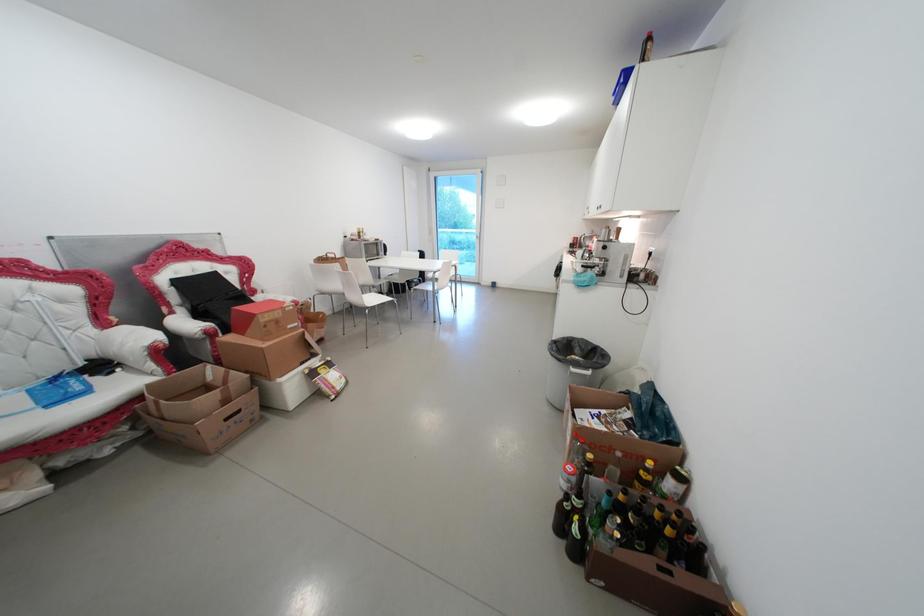
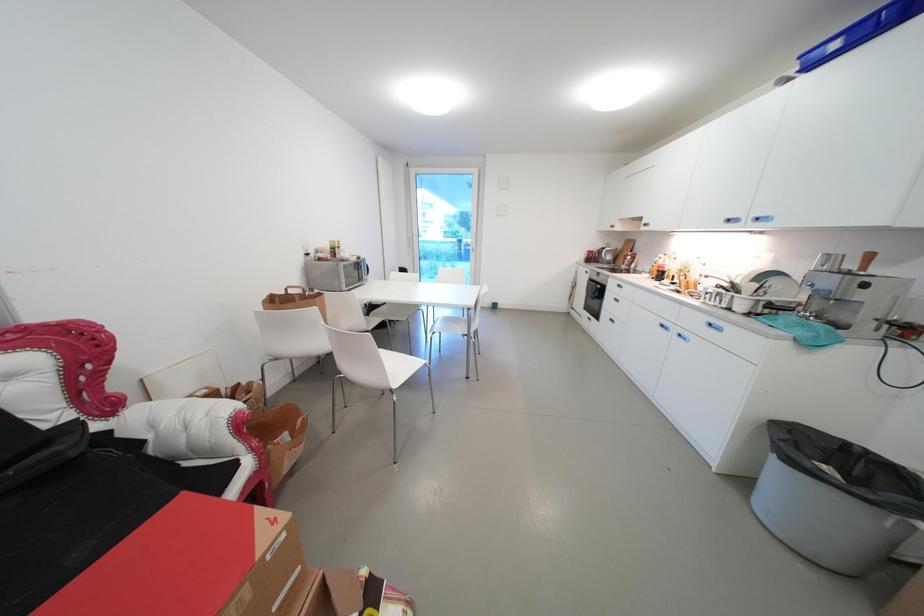
The images are taken continuously from a first-person perspective. In which direction are you moving?

The cameraman moved toward left, forward.